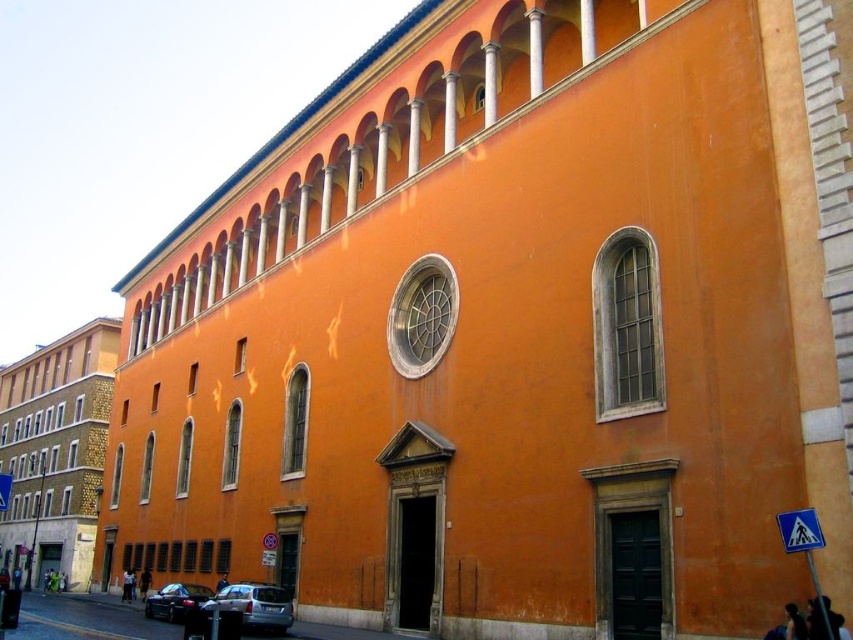
Question: Which of the following is the farthest from the observer?

Choices:
 (A) silver metallic car at lower left
 (B) black leather bag at lower left
 (C) dark blue fabric at lower left
 (D) dark blue fabric at lower right

Answer: (B)

Question: Which of the following is the farthest from the observer?

Choices:
 (A) (227, 580)
 (B) (815, 522)

Answer: (A)

Question: In this image, where is dark blue fabric at lower left located relative to black leather bag at lower left?

Choices:
 (A) above
 (B) below

Answer: (A)

Question: Is shiny black car at lower left above yellow plastic triangle at lower right?

Choices:
 (A) yes
 (B) no

Answer: (B)

Question: Is silver metallic car at lower left positioned at the back of dark blue fabric at center?

Choices:
 (A) no
 (B) yes

Answer: (A)

Question: Which object is the closest to the dark blue fabric at lower left?

Choices:
 (A) dark blue fabric at center
 (B) yellow plastic triangle at lower right

Answer: (A)